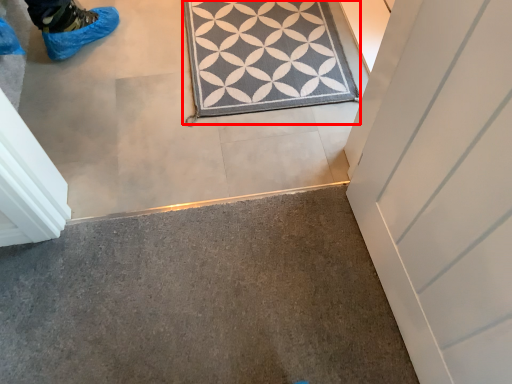
Question: From the image's perspective, where is doormat (annotated by the red box) located in relation to concrete in the image?

Choices:
 (A) below
 (B) above

Answer: (B)